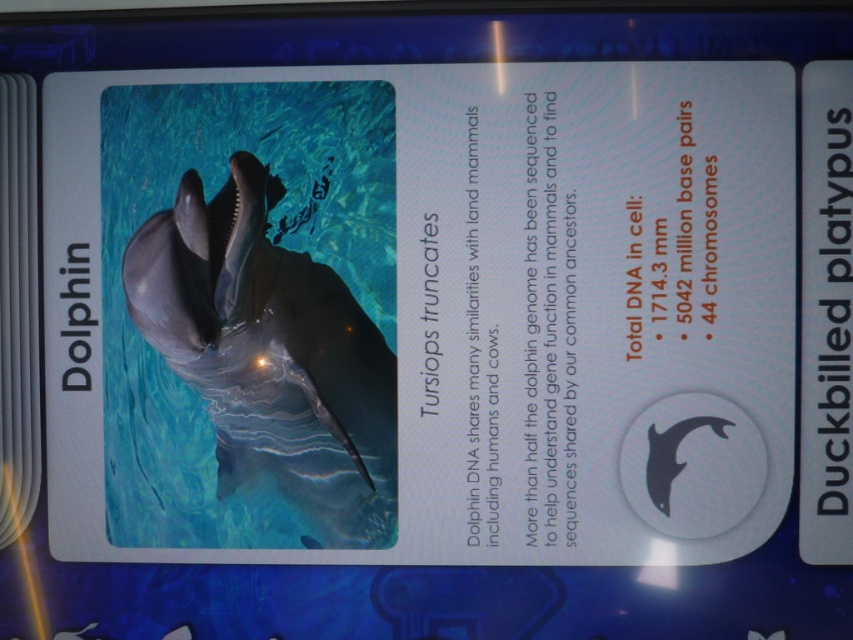
Based on the scene description, where exactly is the shiny gray dolphin at center located?

The shiny gray dolphin at center is located at point (x=271, y=356).

You are an art student observing the dolphin display. You need to sketch the distance between the shiny gray dolphin at center and the black matte dolphin at lower right. How far apart are they?

The shiny gray dolphin at center and the black matte dolphin at lower right are 24.10 inches apart from each other.